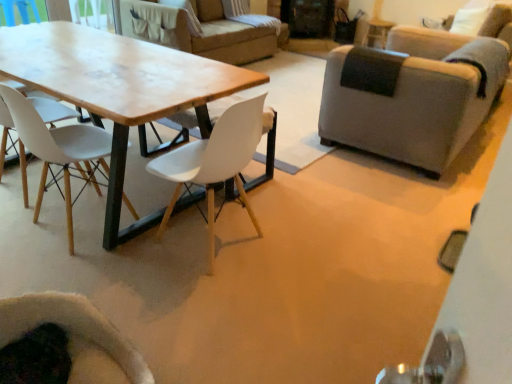
The image size is (512, 384). Find the location of `gray fabric armchair at right, which is counted as the first chair, starting from the right`. gray fabric armchair at right, which is counted as the first chair, starting from the right is located at coordinates (412, 95).

I want to click on velvet dark green armchair at lower left, which is the 2th chair in left-to-right order, so click(x=77, y=337).

Can you confirm if velvet dark green armchair at lower left, which is the third chair from right to left, is positioned to the left of gray fabric armchair at right, which is counted as the first chair, starting from the right?

Yes, velvet dark green armchair at lower left, which is the third chair from right to left, is to the left of gray fabric armchair at right, which is counted as the first chair, starting from the right.

How many degrees apart are the facing directions of velvet dark green armchair at lower left, which is the 2th chair in left-to-right order, and gray fabric armchair at right, the 4th chair in the left-to-right sequence?

The angular difference between velvet dark green armchair at lower left, which is the 2th chair in left-to-right order, and gray fabric armchair at right, the 4th chair in the left-to-right sequence, is 93 degrees.

Which of these two, velvet dark green armchair at lower left, which is the third chair from right to left, or gray fabric armchair at right, the 4th chair in the left-to-right sequence, is thinner?

velvet dark green armchair at lower left, which is the third chair from right to left, is thinner.

You are a GUI agent. You are given a task and a screenshot of the screen. Output one action in this format:
    pyautogui.click(x=<x>, y=<y>)
    Task: Click on the 3rd chair behind the velvet dark green armchair at lower left, which is the third chair from right to left
    
    Given the screenshot: What is the action you would take?
    pyautogui.click(x=412, y=95)

Considering the relative positions of white matte chair at left, which is the first chair in left-to-right order, and velvet dark green armchair at lower left, which is the third chair from right to left, in the image provided, is white matte chair at left, which is the first chair in left-to-right order, to the right of velvet dark green armchair at lower left, which is the third chair from right to left, from the viewer's perspective?

No, white matte chair at left, which is the first chair in left-to-right order, is not to the right of velvet dark green armchair at lower left, which is the third chair from right to left.

Which of these two, white matte chair at left, which is the first chair in left-to-right order, or velvet dark green armchair at lower left, which is the third chair from right to left, is thinner?

Thinner between the two is velvet dark green armchair at lower left, which is the third chair from right to left.

From the image's perspective, between white matte chair at left, which is counted as the fourth chair, starting from the right, and velvet dark green armchair at lower left, which is the 2th chair in left-to-right order, who is located below?

velvet dark green armchair at lower left, which is the 2th chair in left-to-right order, appears lower in the image.

Does wooden table at center have a smaller size compared to velvet dark green armchair at lower left, which is the third chair from right to left?

Incorrect, wooden table at center is not smaller in size than velvet dark green armchair at lower left, which is the third chair from right to left.

Are wooden table at center and velvet dark green armchair at lower left, which is the third chair from right to left, beside each other?

No.

Consider the image. Between wooden table at center and velvet dark green armchair at lower left, which is the third chair from right to left, which one has more height?

With more height is wooden table at center.

Would you say white matte chair at left, which is counted as the fourth chair, starting from the right, is part of gray fabric armchair at right, the 4th chair in the left-to-right sequence,'s contents?

No, white matte chair at left, which is counted as the fourth chair, starting from the right, is not inside gray fabric armchair at right, the 4th chair in the left-to-right sequence.

Considering the sizes of gray fabric armchair at right, the 4th chair in the left-to-right sequence, and white matte chair at left, which is the first chair in left-to-right order, in the image, is gray fabric armchair at right, the 4th chair in the left-to-right sequence, wider or thinner than white matte chair at left, which is the first chair in left-to-right order,?

Clearly, gray fabric armchair at right, the 4th chair in the left-to-right sequence, has more width compared to white matte chair at left, which is the first chair in left-to-right order.

Does gray fabric armchair at right, the 4th chair in the left-to-right sequence, have a greater height compared to white matte chair at left, which is the first chair in left-to-right order?

No, gray fabric armchair at right, the 4th chair in the left-to-right sequence, is not taller than white matte chair at left, which is the first chair in left-to-right order.

Can you confirm if gray fabric armchair at right, which is counted as the first chair, starting from the right, is bigger than white matte chair at left, which is counted as the fourth chair, starting from the right?

Yes.

How many degrees apart are the facing directions of white matte chair at center, the 2th chair in the right-to-left sequence, and white matte chair at left, which is the first chair in left-to-right order?

white matte chair at center, the 2th chair in the right-to-left sequence, and white matte chair at left, which is the first chair in left-to-right order, are facing 88.4 degrees away from each other.

Is white matte chair at center, the 2th chair in the right-to-left sequence, outside of white matte chair at left, which is counted as the fourth chair, starting from the right?

That's correct, white matte chair at center, the 2th chair in the right-to-left sequence, is outside of white matte chair at left, which is counted as the fourth chair, starting from the right.

From the picture: Considering the sizes of objects white matte chair at center, the 2th chair in the right-to-left sequence, and white matte chair at left, which is counted as the fourth chair, starting from the right, in the image provided, who is shorter, white matte chair at center, the 2th chair in the right-to-left sequence, or white matte chair at left, which is counted as the fourth chair, starting from the right,?

white matte chair at left, which is counted as the fourth chair, starting from the right, is shorter.

Is white matte chair at center, positioned as the 3th chair in left-to-right order, bigger or smaller than white matte chair at left, which is the first chair in left-to-right order?

In the image, white matte chair at center, positioned as the 3th chair in left-to-right order, appears to be larger than white matte chair at left, which is the first chair in left-to-right order.

Is velvet dark green armchair at lower left, which is the 2th chair in left-to-right order, oriented towards white matte chair at left, which is counted as the fourth chair, starting from the right?

No.

Between velvet dark green armchair at lower left, which is the 2th chair in left-to-right order, and white matte chair at left, which is counted as the fourth chair, starting from the right, which one has less height?

Standing shorter between the two is velvet dark green armchair at lower left, which is the 2th chair in left-to-right order.

Is velvet dark green armchair at lower left, which is the third chair from right to left, inside the boundaries of white matte chair at left, which is the first chair in left-to-right order, or outside?

The correct answer is: outside.

How much distance is there between white matte chair at left, which is the first chair in left-to-right order, and white matte chair at center, the 2th chair in the right-to-left sequence?

white matte chair at left, which is the first chair in left-to-right order, and white matte chair at center, the 2th chair in the right-to-left sequence, are 20.29 inches apart from each other.

From a real-world perspective, who is located lower, white matte chair at left, which is the first chair in left-to-right order, or white matte chair at center, the 2th chair in the right-to-left sequence?

white matte chair at left, which is the first chair in left-to-right order, is physically lower.

Does white matte chair at left, which is counted as the fourth chair, starting from the right, appear on the right side of white matte chair at center, the 2th chair in the right-to-left sequence?

In fact, white matte chair at left, which is counted as the fourth chair, starting from the right, is to the left of white matte chair at center, the 2th chair in the right-to-left sequence.

What are the coordinates of `chair that is the 1st one when counting forward from the white matte chair at left, which is the first chair in left-to-right order` in the screenshot? It's located at (215, 161).

From the image's perspective, starting from the velvet dark green armchair at lower left, which is the 2th chair in left-to-right order, which chair is the 3rd one above? Please provide its 2D coordinates.

[(412, 95)]

From a real-world perspective, which chair is the 2nd one underneath the white matte chair at left, which is the first chair in left-to-right order? Please provide its 2D coordinates.

[(77, 337)]

Which object lies nearer to the anchor point white matte chair at left, which is counted as the fourth chair, starting from the right, velvet dark green armchair at lower left, which is the 2th chair in left-to-right order, or wooden table at center?

wooden table at center is closer to white matte chair at left, which is counted as the fourth chair, starting from the right.

Which object lies nearer to the anchor point wooden table at center, gray fabric armchair at right, which is counted as the first chair, starting from the right, or white matte chair at left, which is the first chair in left-to-right order?

white matte chair at left, which is the first chair in left-to-right order, is closer to wooden table at center.

From the image, which object appears to be nearer to white matte chair at left, which is counted as the fourth chair, starting from the right, wooden table at center or gray fabric armchair at right, which is counted as the first chair, starting from the right?

Based on the image, wooden table at center appears to be nearer to white matte chair at left, which is counted as the fourth chair, starting from the right.

Looking at the image, which one is located further to wooden table at center, gray fabric armchair at right, the 4th chair in the left-to-right sequence, or velvet dark green armchair at lower left, which is the 2th chair in left-to-right order?

The object further to wooden table at center is gray fabric armchair at right, the 4th chair in the left-to-right sequence.

In the scene shown: Based on their spatial positions, is velvet dark green armchair at lower left, which is the third chair from right to left, or white matte chair at center, positioned as the 3th chair in left-to-right order, further from white matte chair at left, which is the first chair in left-to-right order?

velvet dark green armchair at lower left, which is the third chair from right to left.

Looking at the image, which one is located further to gray fabric armchair at right, the 4th chair in the left-to-right sequence, white matte chair at left, which is the first chair in left-to-right order, or velvet dark green armchair at lower left, which is the third chair from right to left?

Among the two, velvet dark green armchair at lower left, which is the third chair from right to left, is located further to gray fabric armchair at right, the 4th chair in the left-to-right sequence.

From the image, which object appears to be nearer to white matte chair at left, which is the first chair in left-to-right order, white matte chair at center, positioned as the 3th chair in left-to-right order, or wooden table at center?

wooden table at center lies closer to white matte chair at left, which is the first chair in left-to-right order, than the other object.

Which object lies nearer to the anchor point velvet dark green armchair at lower left, which is the 2th chair in left-to-right order, white matte chair at center, the 2th chair in the right-to-left sequence, or wooden table at center?

white matte chair at center, the 2th chair in the right-to-left sequence, lies closer to velvet dark green armchair at lower left, which is the 2th chair in left-to-right order, than the other object.

The image size is (512, 384). What are the coordinates of `chair situated between velvet dark green armchair at lower left, which is the 2th chair in left-to-right order, and gray fabric armchair at right, the 4th chair in the left-to-right sequence, from left to right` in the screenshot? It's located at (215, 161).

The width and height of the screenshot is (512, 384). I want to click on chair between white matte chair at left, which is the first chair in left-to-right order, and velvet dark green armchair at lower left, which is the 2th chair in left-to-right order, from top to bottom, so click(215, 161).